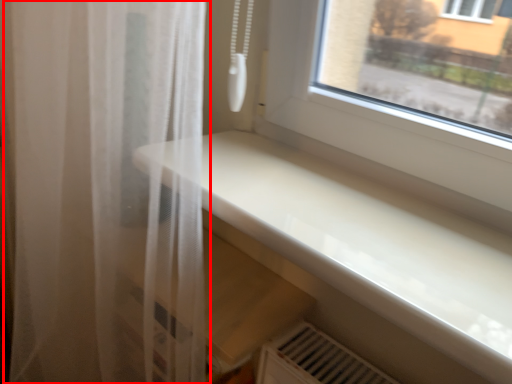
Question: From the image, what is the correct spatial relationship of curtain (annotated by the red box) in relation to counter top?

Choices:
 (A) right
 (B) left

Answer: (B)